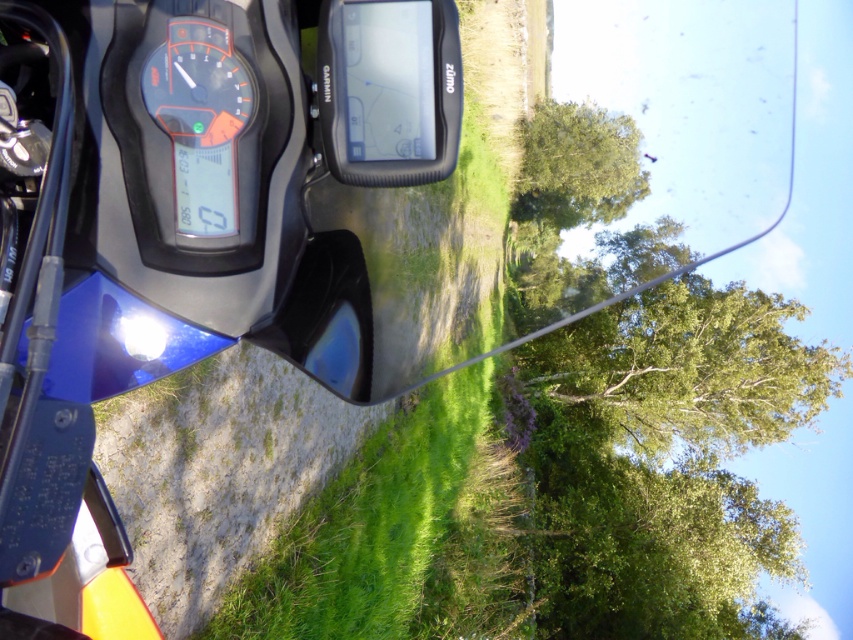
Is transparent plastic gps at center thinner than green leafy tree at upper center?

Correct, transparent plastic gps at center's width is less than green leafy tree at upper center's.

Does transparent plastic gps at center have a lesser height compared to green leafy tree at upper center?

Correct, transparent plastic gps at center is not as tall as green leafy tree at upper center.

Which is in front, point (386, 26) or point (564, 208)?

Point (386, 26)

Where is `transparent plastic gps at center`? transparent plastic gps at center is located at coordinates (389, 90).

Can you confirm if blue glossy motorcycle at center is positioned below green leafy tree at upper center?

Indeed, blue glossy motorcycle at center is positioned under green leafy tree at upper center.

Consider the image. Which is more to the left, blue glossy motorcycle at center or green leafy tree at upper center?

Positioned to the left is blue glossy motorcycle at center.

Locate an element on the screen. This screenshot has height=640, width=853. blue glossy motorcycle at center is located at coordinates (181, 236).

Based on the photo, is blue glossy motorcycle at center behind orange glossy gauge at center?

No, blue glossy motorcycle at center is closer to the viewer.

Is blue glossy motorcycle at center to the right of orange glossy gauge at center from the viewer's perspective?

Incorrect, blue glossy motorcycle at center is not on the right side of orange glossy gauge at center.

Where is `blue glossy motorcycle at center`? Image resolution: width=853 pixels, height=640 pixels. blue glossy motorcycle at center is located at coordinates (181, 236).